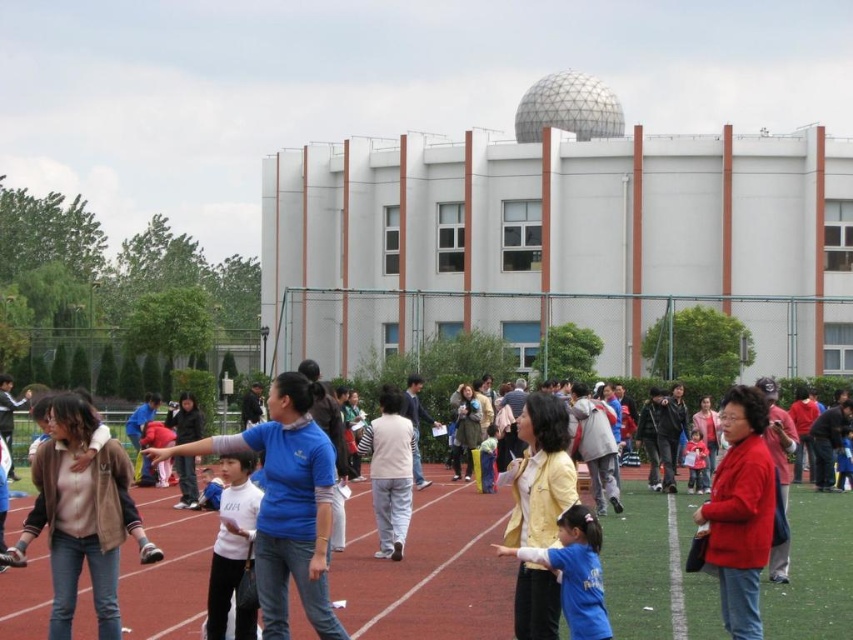
You are standing at the center of the red running track and see two points marked on the ground. The first point is at coordinate point[578,596] and the second point is at coordinate point[143,435]. Which point is closer to you?

Point[578,596] is in front of point[143,435], so it is closer to you.

You are organizing a group photo and need to position two people wearing red matte jackets. The red matte jacket at lower right and the matte red jacket at center are already placed. Can you fit another person wearing a red jacket between them if the person is 2 feet wide?

The distance between the red matte jacket at lower right and the matte red jacket at center is 23.02 feet. Since the person is only 2 feet wide, there is sufficient space to fit them between the two jackets.